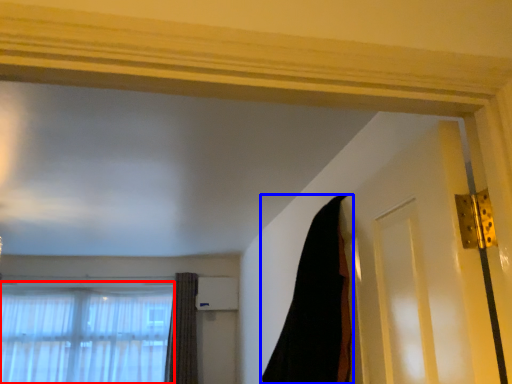
Question: Which point is closer to the camera, window (highlighted by a red box) or curtain (highlighted by a blue box)?

Choices:
 (A) window
 (B) curtain

Answer: (B)